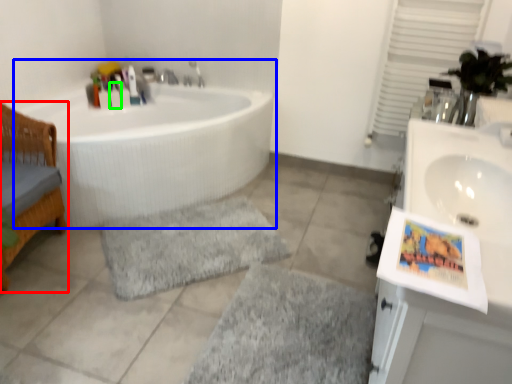
Question: Based on their relative distances, which object is nearer to furniture (highlighted by a red box)? Choose from bathtub (highlighted by a blue box) and toiletry (highlighted by a green box).

Choices:
 (A) bathtub
 (B) toiletry

Answer: (A)